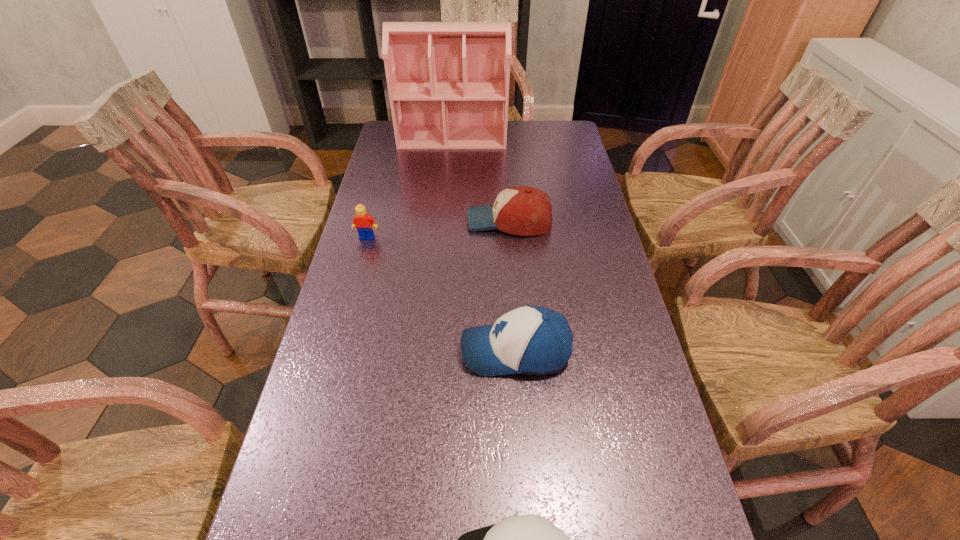
Identify the location of vacant space at the far right corner of the desktop. 542,125.

At what (x,y) coordinates should I click in order to perform the action: click on empty space that is in between the second nearest object and the Lego. Please return your answer as a coordinate pair (x, y). The image size is (960, 540). Looking at the image, I should click on (442, 294).

You are a GUI agent. You are given a task and a screenshot of the screen. Output one action in this format:
    pyautogui.click(x=<x>, y=<y>)
    Task: Click on the free area in between the farthest object and the farthest baseball cap
    The image size is (960, 540).
    Given the screenshot: What is the action you would take?
    pyautogui.click(x=481, y=179)

At what (x,y) coordinates should I click in order to perform the action: click on free space between the farthest baseball cap and the second farthest baseball cap. Please return your answer as a coordinate pair (x, y). Looking at the image, I should click on (513, 286).

Image resolution: width=960 pixels, height=540 pixels. In order to click on vacant space that's between the Lego and the fourth farthest object in this screenshot , I will do `click(442, 294)`.

You are a GUI agent. You are given a task and a screenshot of the screen. Output one action in this format:
    pyautogui.click(x=<x>, y=<y>)
    Task: Click on the vacant point located between the second nearest baseball cap and the farthest object
    
    Given the screenshot: What is the action you would take?
    pyautogui.click(x=484, y=244)

Identify the location of object that ranks as the second closest to the nearest object. (519, 210).

Identify which object is the closest to the farthest object. Please provide its 2D coordinates. Your answer should be formatted as a tuple, i.e. [(x, y)], where the tuple contains the x and y coordinates of a point satisfying the conditions above.

[(519, 210)]

Select which baseball cap is the closest to the dollhouse. Please provide its 2D coordinates. Your answer should be formatted as a tuple, i.e. [(x, y)], where the tuple contains the x and y coordinates of a point satisfying the conditions above.

[(519, 210)]

Locate an element on the screen. Image resolution: width=960 pixels, height=540 pixels. baseball cap identified as the second closest to the nearest object is located at coordinates [519, 210].